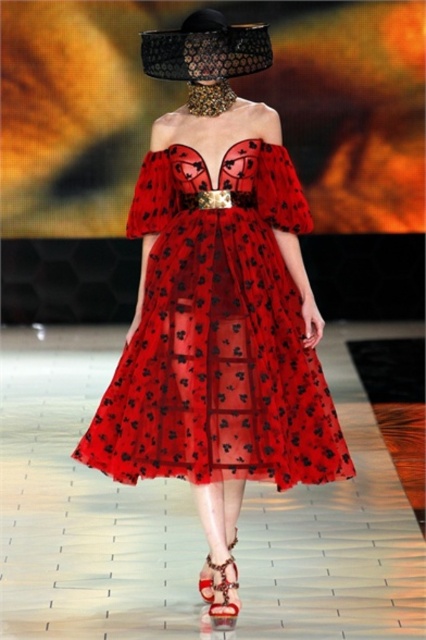
Who is shorter, translucent red dress at center or leather/textured sandal at lower center?

leather/textured sandal at lower center

Can you confirm if translucent red dress at center is taller than leather/textured sandal at lower center?

Indeed, translucent red dress at center has a greater height compared to leather/textured sandal at lower center.

The image size is (426, 640). What do you see at coordinates (218, 333) in the screenshot? I see `translucent red dress at center` at bounding box center [218, 333].

The image size is (426, 640). Find the location of `translucent red dress at center`. translucent red dress at center is located at coordinates (218, 333).